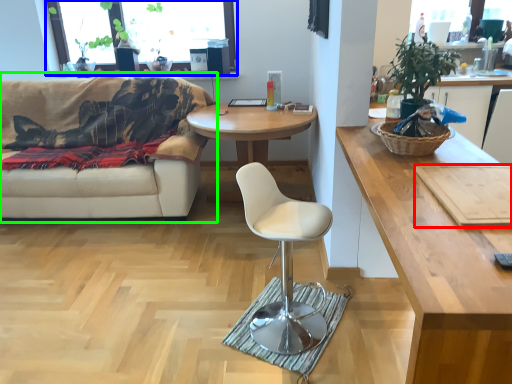
Question: Based on their relative distances, which object is farther from plank (highlighted by a red box)? Choose from window screen (highlighted by a blue box) and studio couch (highlighted by a green box).

Choices:
 (A) window screen
 (B) studio couch

Answer: (A)